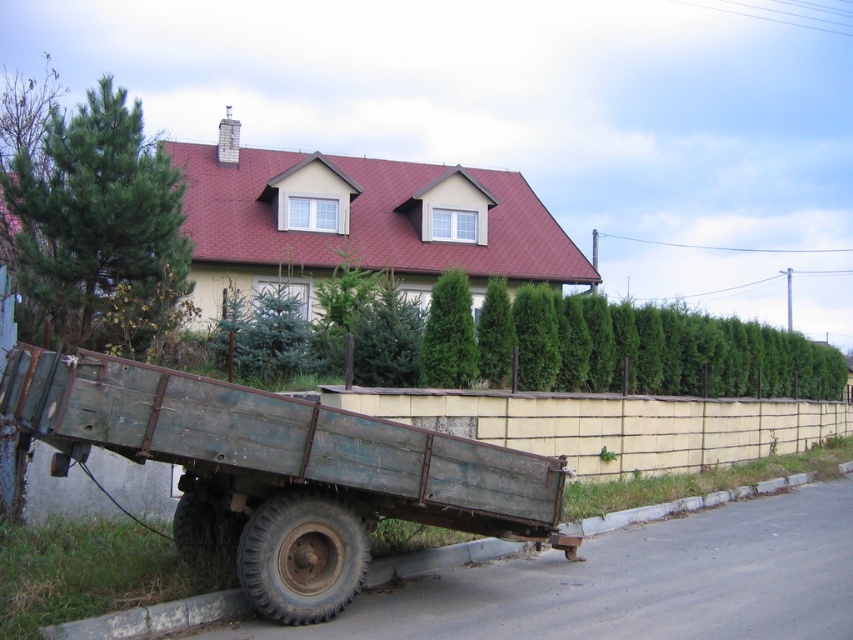
Question: Which is nearer to the rusty metal wagon at lower left?

Choices:
 (A) gray concrete curb at lower left
 (B) green leafy hedge at center

Answer: (A)

Question: Among these objects, which one is farthest from the camera?

Choices:
 (A) rusty metal wagon at lower left
 (B) gray concrete curb at lower left
 (C) green leafy hedge at center

Answer: (C)

Question: Is rusty metal wagon at lower left closer to camera compared to gray concrete curb at lower left?

Choices:
 (A) no
 (B) yes

Answer: (B)

Question: Does rusty metal wagon at lower left appear on the left side of gray concrete curb at lower left?

Choices:
 (A) no
 (B) yes

Answer: (B)

Question: Observing the image, what is the correct spatial positioning of rusty metal wagon at lower left in reference to gray concrete curb at lower left?

Choices:
 (A) left
 (B) right

Answer: (A)

Question: Which object is closer to the camera taking this photo?

Choices:
 (A) green leafy hedge at center
 (B) rusty metal wagon at lower left
 (C) gray concrete curb at lower left

Answer: (B)